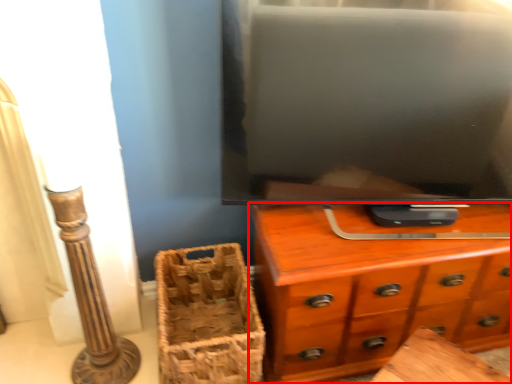
Question: From the image's perspective, what is the correct spatial relationship of chest of drawers (annotated by the red box) in relation to basket?

Choices:
 (A) below
 (B) above

Answer: (B)